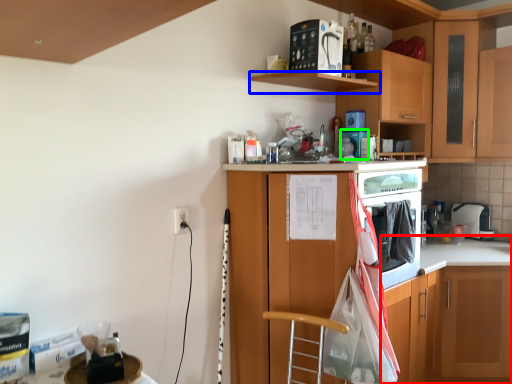
Question: Estimate the real-world distances between objects in this image. Which object is closer to counter (highlighted by a red box), shelf (highlighted by a blue box) or appliance (highlighted by a green box)?

Choices:
 (A) shelf
 (B) appliance

Answer: (B)